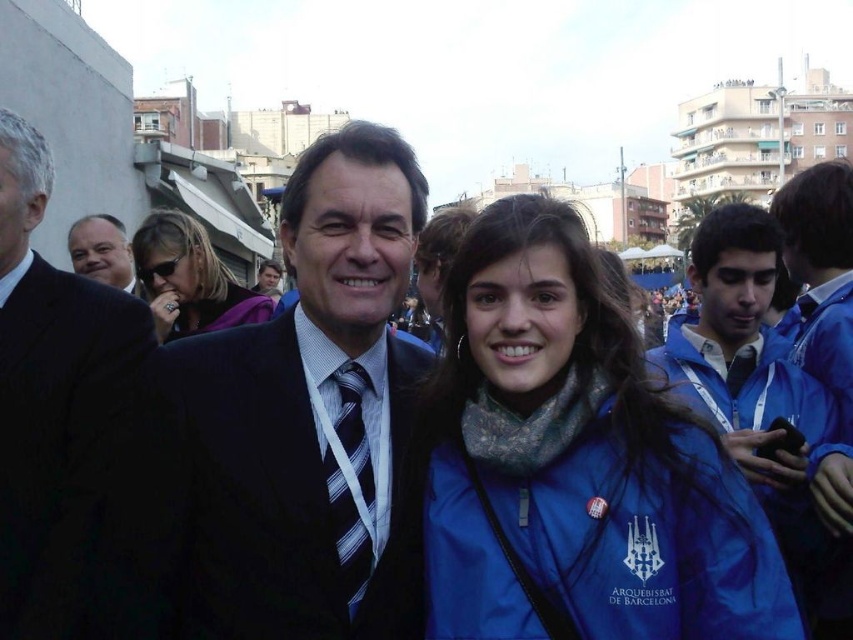
Question: Which point is closer to the camera?

Choices:
 (A) (74, 228)
 (B) (701, 298)
 (C) (193, 314)
 (D) (352, 580)

Answer: (D)

Question: Which point is closer to the camera?

Choices:
 (A) striped fabric tie at center
 (B) blue fabric jacket at right
 (C) matte black sunglasses at upper left
 (D) black suit at left

Answer: (D)

Question: Can you confirm if black suit at left is positioned to the left of striped fabric tie at center?

Choices:
 (A) no
 (B) yes

Answer: (B)

Question: Can you confirm if blue fabric jacket at center is positioned to the left of blue fabric jacket at right?

Choices:
 (A) no
 (B) yes

Answer: (B)

Question: Among these objects, which one is nearest to the camera?

Choices:
 (A) black suit at center
 (B) blue fabric jacket at center
 (C) blue fabric jacket at right

Answer: (B)

Question: Where is matte black sunglasses at upper left located in relation to matte black suit at left in the image?

Choices:
 (A) right
 (B) left

Answer: (A)